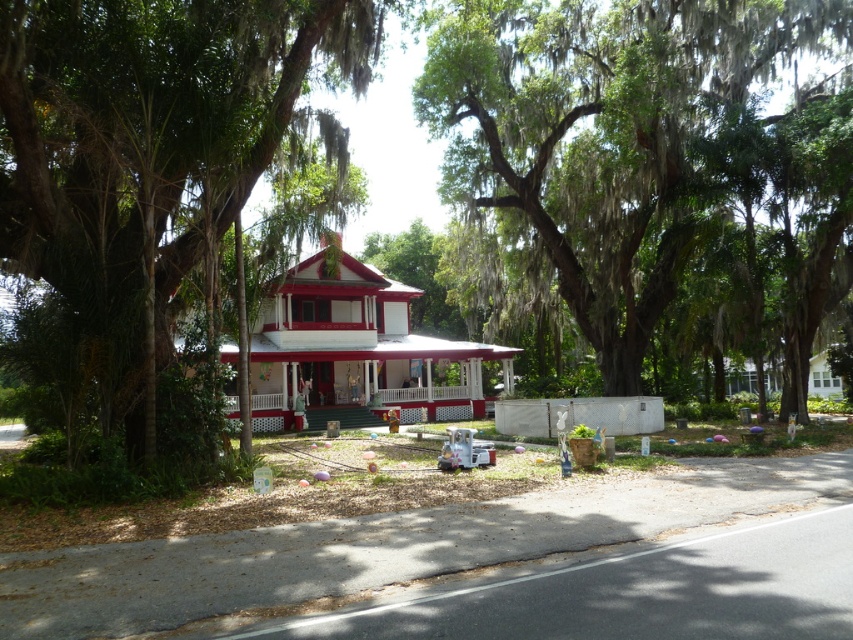
Which is in front, point (123, 99) or point (258, 314)?

Point (123, 99)

Is green leafy tree at center to the right of white painted wood gazebo at center from the viewer's perspective?

No, green leafy tree at center is not to the right of white painted wood gazebo at center.

You are a GUI agent. You are given a task and a screenshot of the screen. Output one action in this format:
    pyautogui.click(x=<x>, y=<y>)
    Task: Click on the green leafy tree at center
    This screenshot has width=853, height=640.
    Given the screenshot: What is the action you would take?
    click(x=148, y=150)

Who is taller, green leafy tree at center or white painted wood porch at center?

white painted wood porch at center is taller.

Is green leafy tree at center positioned at the back of white painted wood porch at center?

No, it is not.

The height and width of the screenshot is (640, 853). What do you see at coordinates (148, 150) in the screenshot? I see `green leafy tree at center` at bounding box center [148, 150].

This screenshot has width=853, height=640. I want to click on green leafy tree at center, so click(x=148, y=150).

Does point (563, 90) lie in front of point (453, 420)?

Yes, point (563, 90) is in front of point (453, 420).

Looking at this image, how much distance is there between green mossy tree at center and white painted wood porch at center?

green mossy tree at center is 13.24 meters from white painted wood porch at center.

Which is behind, point (660, 289) or point (450, 417)?

Positioned behind is point (450, 417).

The image size is (853, 640). What are the coordinates of `green mossy tree at center` in the screenshot? It's located at (627, 145).